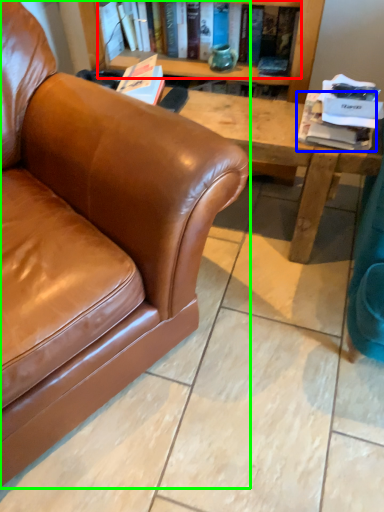
Question: Which object is the closest to the book (highlighted by a red box)? Choose among these: book (highlighted by a blue box) or studio couch (highlighted by a green box).

Choices:
 (A) book
 (B) studio couch

Answer: (A)